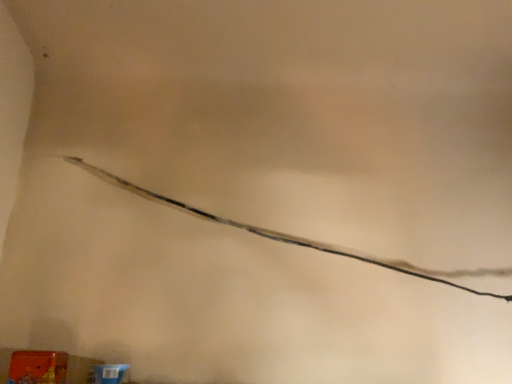
Question: Should I look upward or downward to see matte orange toy at lower left?

Choices:
 (A) down
 (B) up

Answer: (A)